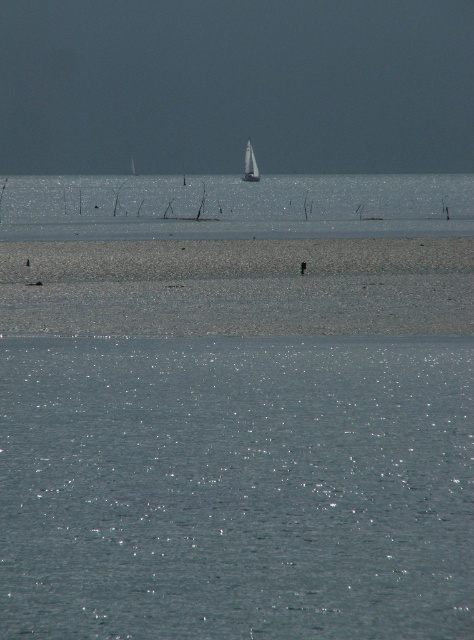
What is the exact coordinate of the sparkling silver water at center in the image?

The sparkling silver water at center is located at coordinate point (236,486).

You are a photographer standing on the beach and want to capture both the sparkling silver water at center and the white glossy sailboat at upper center in a single shot. Based on their distance, will you need to adjust your camera settings to ensure both are in focus?

The sparkling silver water at center is 207.37 meters from the white glossy sailboat at upper center. Since the distance between them is significant, you will need to adjust your camera settings to ensure both are in focus.